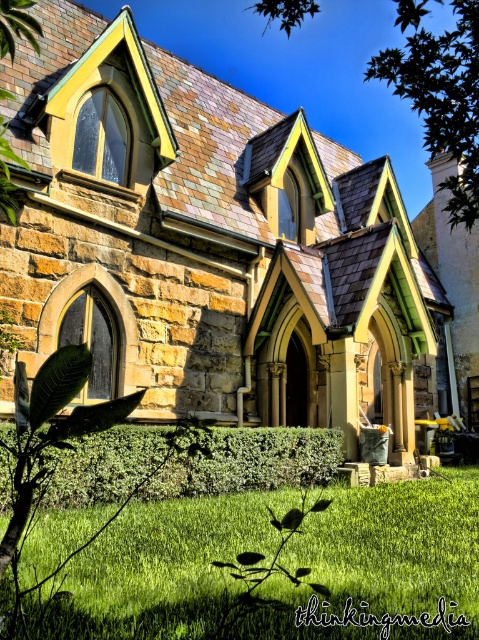
Question: Which of the following is the farthest from the observer?

Choices:
 (A) green leafy tree at upper center
 (B) brown stone church at center

Answer: (B)

Question: Which is farther from the brown stone church at center?

Choices:
 (A) green grass at lower center
 (B) green leafy tree at upper center

Answer: (A)

Question: Where is brown stone church at center located in relation to green grass at lower center in the image?

Choices:
 (A) above
 (B) below

Answer: (A)

Question: Is brown stone church at center below green leafy tree at upper center?

Choices:
 (A) no
 (B) yes

Answer: (B)

Question: Which of the following is the farthest from the observer?

Choices:
 (A) (329, 609)
 (B) (369, 77)

Answer: (B)

Question: Is brown stone church at center above green grass at lower center?

Choices:
 (A) yes
 (B) no

Answer: (A)